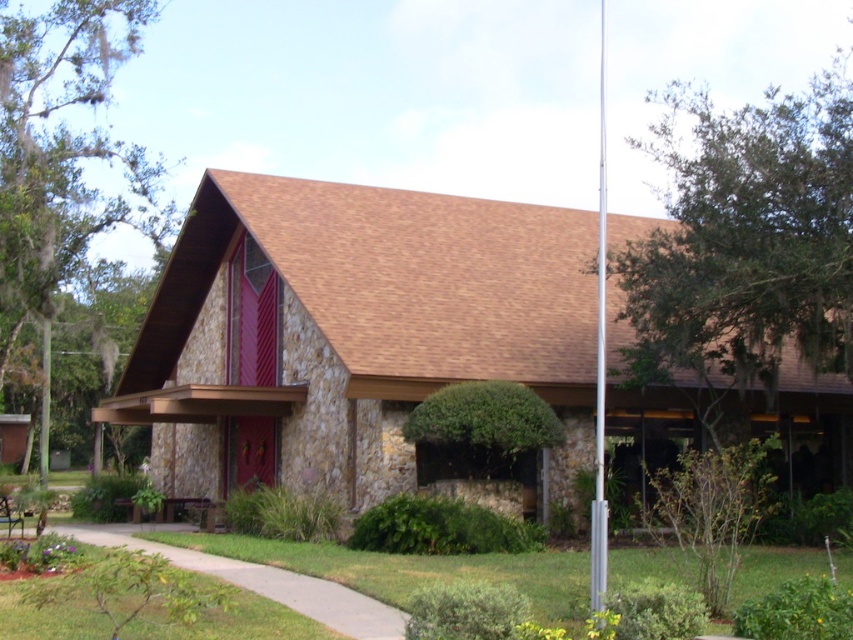
Question: In this image, where is green leafy tree at upper right located relative to green mossy tree at lower left?

Choices:
 (A) above
 (B) below

Answer: (A)

Question: Which of these objects is positioned farthest from the silver metallic flag pole at center?

Choices:
 (A) green leafy tree at upper right
 (B) green mossy tree at lower left

Answer: (B)

Question: Among these points, which one is nearest to the camera?

Choices:
 (A) (529, 205)
 (B) (16, 10)
 (C) (601, 10)
 (D) (730, 298)

Answer: (D)

Question: Which of these objects is positioned farthest from the green leafy tree at upper right?

Choices:
 (A) green mossy tree at lower left
 (B) silver metallic flag pole at center

Answer: (A)

Question: Does green mossy tree at lower left lie behind silver metallic flag pole at center?

Choices:
 (A) no
 (B) yes

Answer: (B)

Question: Does green leafy tree at upper right appear over green mossy tree at lower left?

Choices:
 (A) yes
 (B) no

Answer: (A)